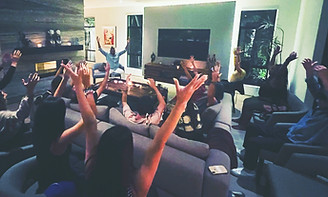
The height and width of the screenshot is (197, 328). In order to click on couch in this screenshot , I will do `click(192, 189)`.